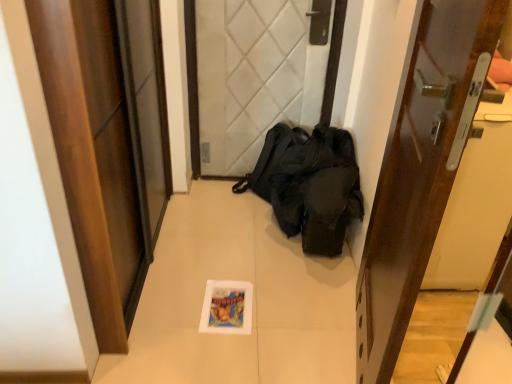
Question: Does white quilted fabric at center, which is the second door in left-to-right order, touch wooden glossy door at right, arranged as the third door when viewed from the left?

Choices:
 (A) no
 (B) yes

Answer: (A)

Question: Is white quilted fabric at center, the second door positioned from the right, at the right side of wooden glossy door at right, arranged as the third door when viewed from the left?

Choices:
 (A) no
 (B) yes

Answer: (A)

Question: Is white quilted fabric at center, which is the second door in left-to-right order, facing towards wooden glossy door at right, the 1th door positioned from the right?

Choices:
 (A) no
 (B) yes

Answer: (B)

Question: Considering the relative sizes of white quilted fabric at center, the second door positioned from the right, and wooden glossy door at right, arranged as the third door when viewed from the left, in the image provided, is white quilted fabric at center, the second door positioned from the right, smaller than wooden glossy door at right, arranged as the third door when viewed from the left,?

Choices:
 (A) no
 (B) yes

Answer: (A)

Question: From the image's perspective, is white quilted fabric at center, which is the second door in left-to-right order, located beneath wooden glossy door at right, the 1th door positioned from the right?

Choices:
 (A) yes
 (B) no

Answer: (B)

Question: Is the depth of white quilted fabric at center, the second door positioned from the right, greater than that of wooden glossy door at right, arranged as the third door when viewed from the left?

Choices:
 (A) no
 (B) yes

Answer: (B)

Question: Can you confirm if wooden door at left, placed as the first door when sorted from left to right, is positioned to the right of white quilted fabric at center, which is the second door in left-to-right order?

Choices:
 (A) yes
 (B) no

Answer: (B)

Question: From the image's perspective, is wooden door at left, which appears as the 3th door when viewed from the right, beneath white quilted fabric at center, which is the second door in left-to-right order?

Choices:
 (A) no
 (B) yes

Answer: (B)

Question: Is wooden door at left, placed as the first door when sorted from left to right, not close to white quilted fabric at center, which is the second door in left-to-right order?

Choices:
 (A) no
 (B) yes

Answer: (B)

Question: Is wooden door at left, placed as the first door when sorted from left to right, oriented away from white quilted fabric at center, the second door positioned from the right?

Choices:
 (A) yes
 (B) no

Answer: (B)

Question: Considering the relative sizes of wooden door at left, placed as the first door when sorted from left to right, and white quilted fabric at center, the second door positioned from the right, in the image provided, is wooden door at left, placed as the first door when sorted from left to right, bigger than white quilted fabric at center, the second door positioned from the right,?

Choices:
 (A) yes
 (B) no

Answer: (A)

Question: Is wooden door at left, which appears as the 3th door when viewed from the right, at the left side of white quilted fabric at center, which is the second door in left-to-right order?

Choices:
 (A) no
 (B) yes

Answer: (B)

Question: Is wooden door at left, which appears as the 3th door when viewed from the right, facing away from wooden glossy door at right, the 1th door positioned from the right?

Choices:
 (A) no
 (B) yes

Answer: (A)